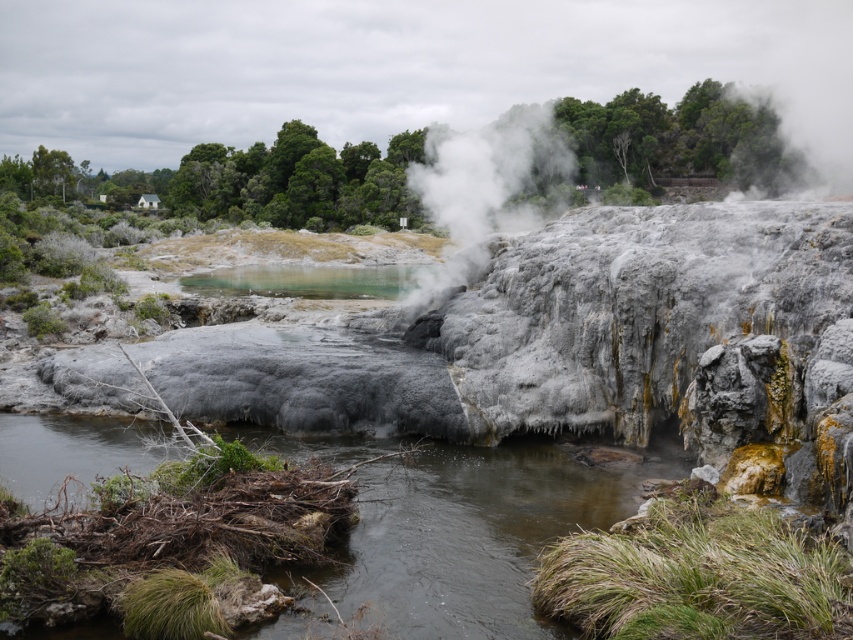
Who is taller, brown wood at center or white fluffy steam at upper center?

With more height is white fluffy steam at upper center.

Is brown wood at center to the right of white fluffy steam at upper center from the viewer's perspective?

No, brown wood at center is not to the right of white fluffy steam at upper center.

I want to click on brown wood at center, so click(x=465, y=536).